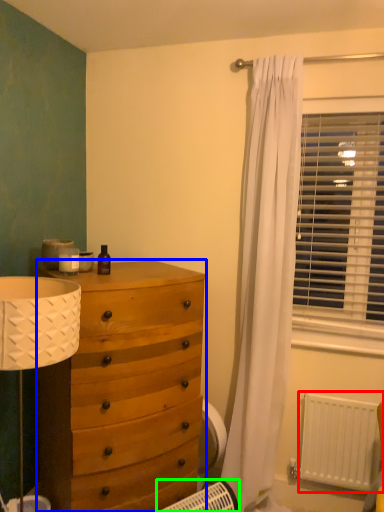
Question: Based on their relative distances, which object is nearer to radiator (highlighted by a red box)? Choose from chest of drawers (highlighted by a blue box) and heater (highlighted by a green box).

Choices:
 (A) chest of drawers
 (B) heater

Answer: (B)